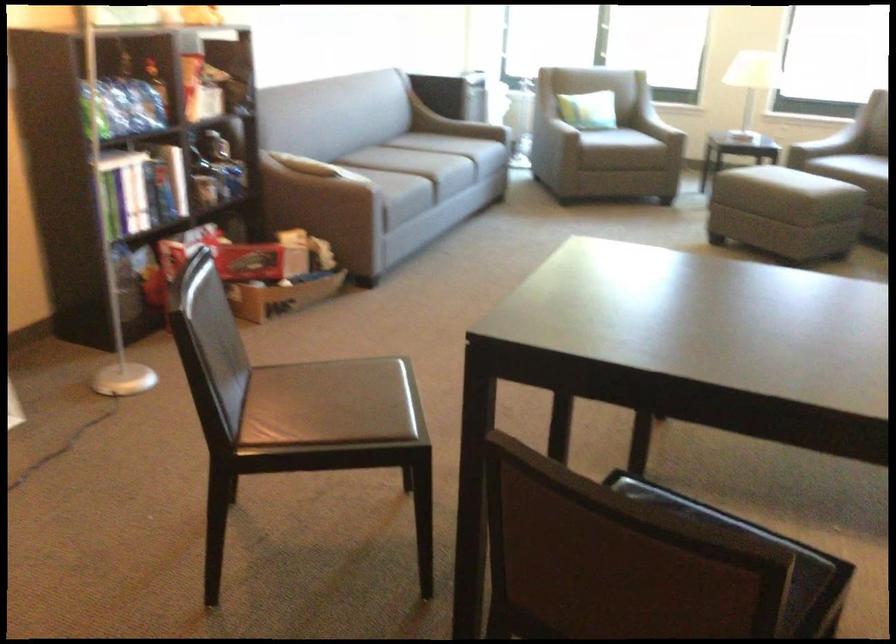
I want to click on beige throw pillow, so click(x=298, y=164).